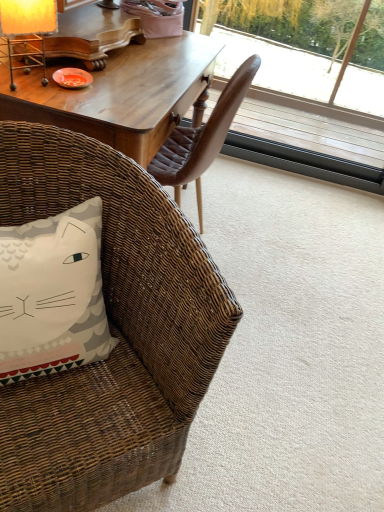
Question: Is white fabric pillow with cat design at lower left directly adjacent to matte yellow lampshade at upper left?

Choices:
 (A) yes
 (B) no

Answer: (B)

Question: From the image's perspective, is white fabric pillow with cat design at lower left under matte yellow lampshade at upper left?

Choices:
 (A) no
 (B) yes

Answer: (B)

Question: Does white fabric pillow with cat design at lower left turn towards matte yellow lampshade at upper left?

Choices:
 (A) no
 (B) yes

Answer: (A)

Question: Does white fabric pillow with cat design at lower left have a greater width compared to matte yellow lampshade at upper left?

Choices:
 (A) no
 (B) yes

Answer: (B)

Question: Is white fabric pillow with cat design at lower left taller than matte yellow lampshade at upper left?

Choices:
 (A) no
 (B) yes

Answer: (A)

Question: In the image, is woven brown chair at lower left on the left side or the right side of transparent glass window at upper right?

Choices:
 (A) left
 (B) right

Answer: (A)

Question: Is point (216, 289) closer or farther from the camera than point (269, 92)?

Choices:
 (A) closer
 (B) farther

Answer: (A)

Question: Is woven brown chair at lower left wider or thinner than transparent glass window at upper right?

Choices:
 (A) wide
 (B) thin

Answer: (A)

Question: Considering their positions, is woven brown chair at lower left located in front of or behind transparent glass window at upper right?

Choices:
 (A) behind
 (B) front

Answer: (B)

Question: Is white fabric pillow with cat design at lower left inside or outside of transparent glass window at upper right?

Choices:
 (A) outside
 (B) inside

Answer: (A)

Question: Is white fabric pillow with cat design at lower left bigger or smaller than transparent glass window at upper right?

Choices:
 (A) small
 (B) big

Answer: (A)

Question: Is white fabric pillow with cat design at lower left wider or thinner than transparent glass window at upper right?

Choices:
 (A) wide
 (B) thin

Answer: (A)

Question: From the image's perspective, is white fabric pillow with cat design at lower left located above or below transparent glass window at upper right?

Choices:
 (A) above
 (B) below

Answer: (B)

Question: Is white fabric pillow with cat design at lower left inside or outside of matte yellow lampshade at upper left?

Choices:
 (A) inside
 (B) outside

Answer: (B)

Question: From a real-world perspective, is white fabric pillow with cat design at lower left physically located above or below matte yellow lampshade at upper left?

Choices:
 (A) below
 (B) above

Answer: (A)